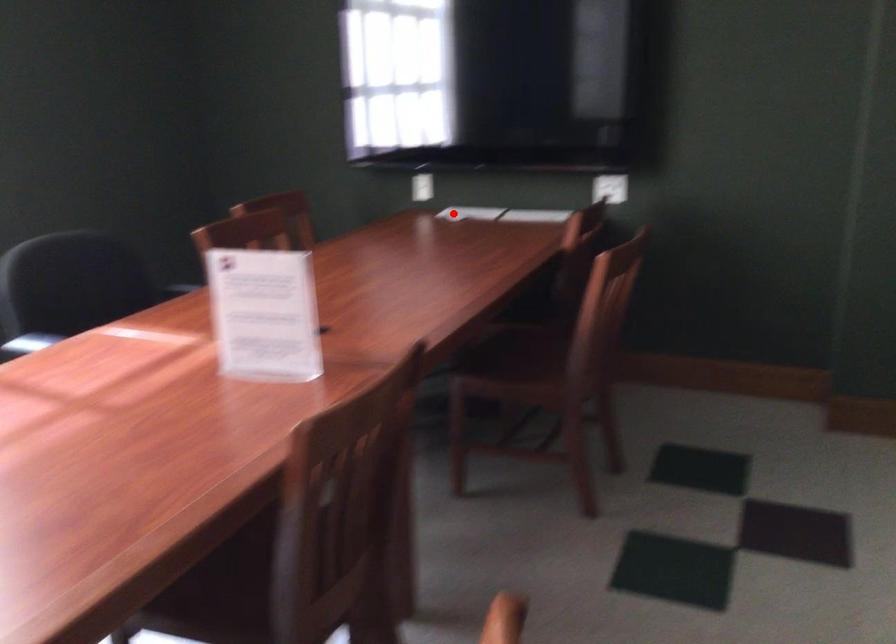
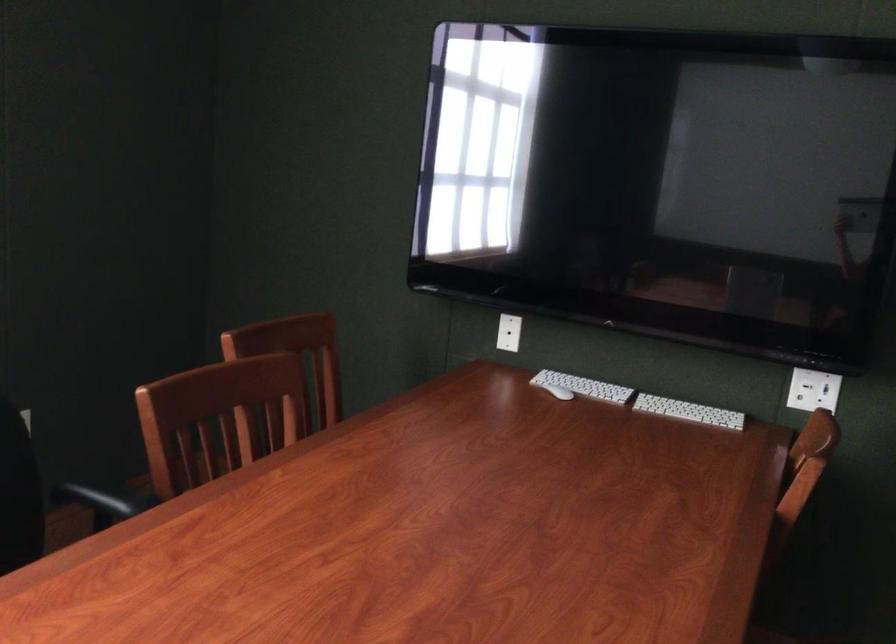
Find the pixel in the second image that matches the highlighted location in the first image.

(558, 392)